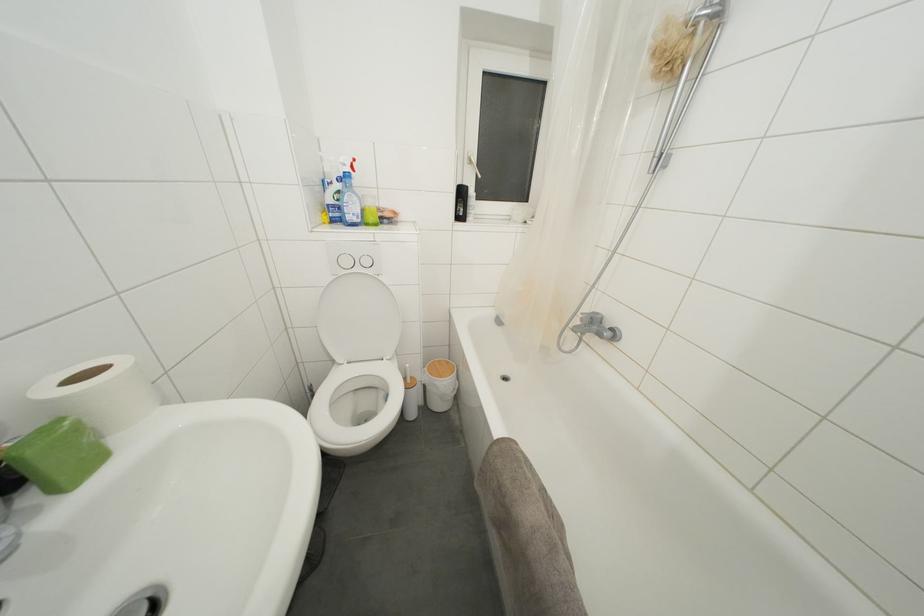
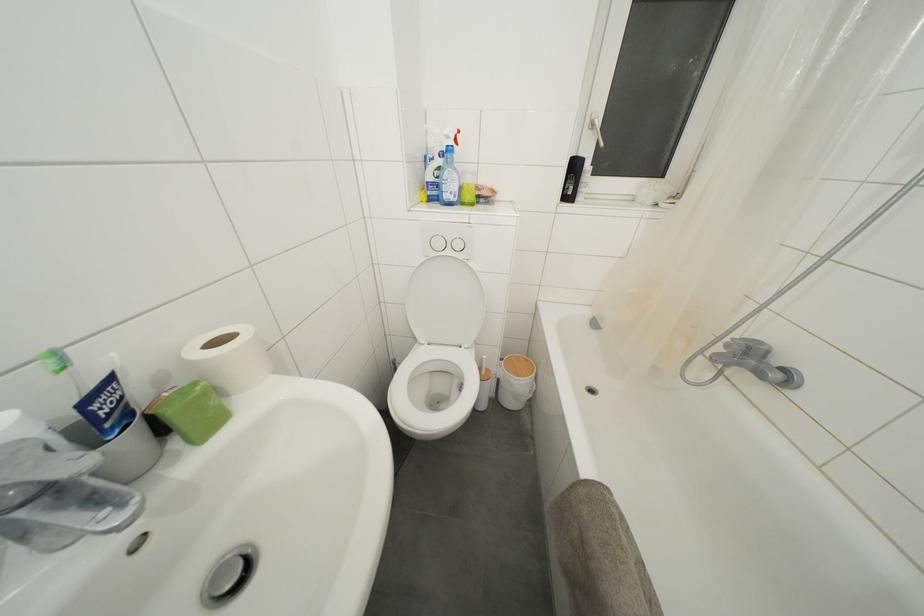
In the second image, find the point that corresponds to point 350,267 in the first image.

(443, 249)